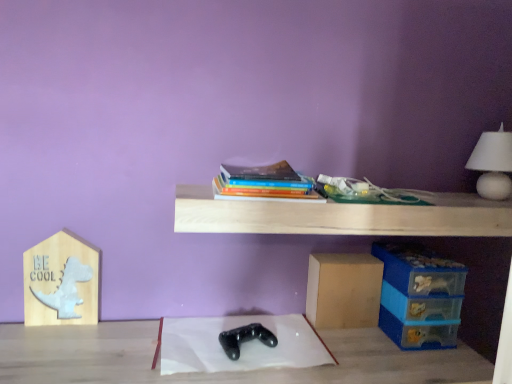
This screenshot has width=512, height=384. In order to click on empty space that is ontop of hardcover books at center (from a real-world perspective) in this screenshot , I will do point(261,165).